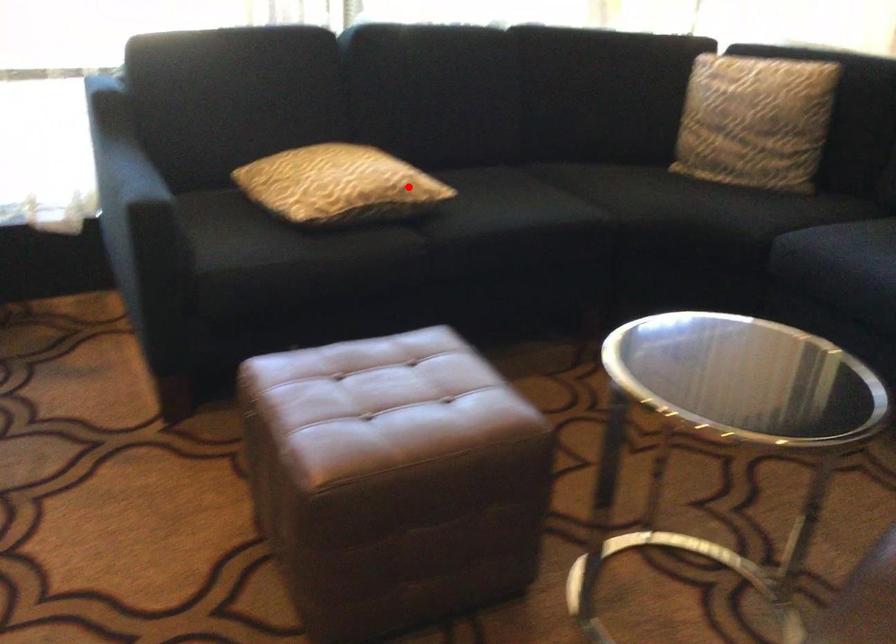
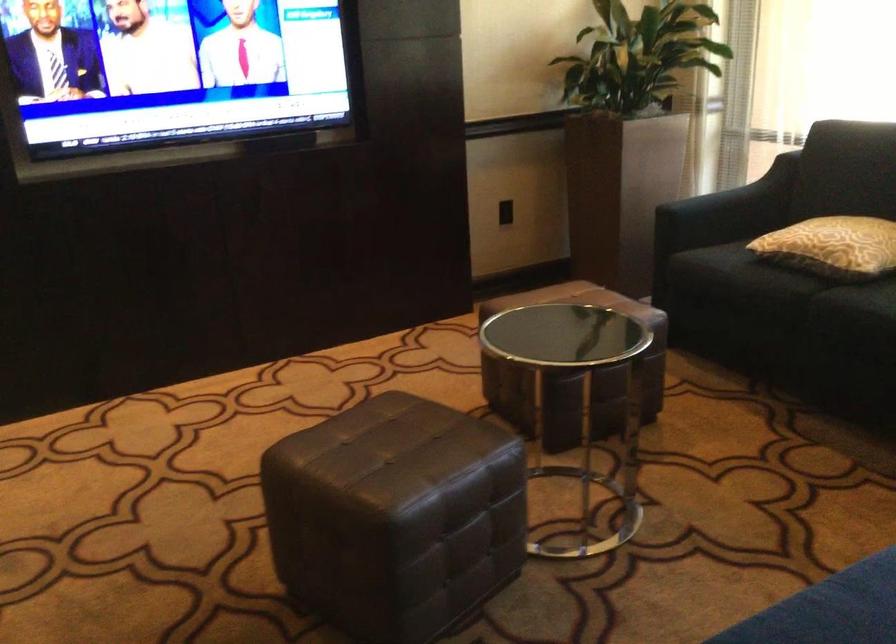
The point at the highlighted location is marked in the first image. Where is the corresponding point in the second image?

(832, 245)